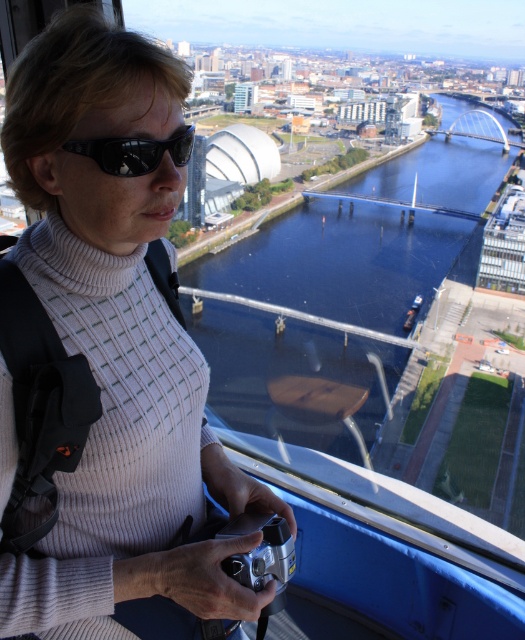
Question: Can you confirm if white ribbed sweater at upper left is thinner than silver metallic camera at lower center?

Choices:
 (A) yes
 (B) no

Answer: (B)

Question: Which point is closer to the camera taking this photo?

Choices:
 (A) (19, 310)
 (B) (271, 435)
 (C) (286, 564)

Answer: (A)

Question: Which point appears farthest from the camera in this image?

Choices:
 (A) (162, 152)
 (B) (110, 608)
 (C) (231, 572)
 (D) (394, 216)

Answer: (D)

Question: Which object is closer to the camera taking this photo?

Choices:
 (A) silver metallic camera at lower center
 (B) black reflective sunglasses at upper center
 (C) blue glassy river at center

Answer: (B)

Question: Does white ribbed sweater at upper left come behind black reflective sunglasses at upper center?

Choices:
 (A) no
 (B) yes

Answer: (A)

Question: Is silver metallic camera at lower center to the right of black reflective sunglasses at upper center from the viewer's perspective?

Choices:
 (A) yes
 (B) no

Answer: (A)